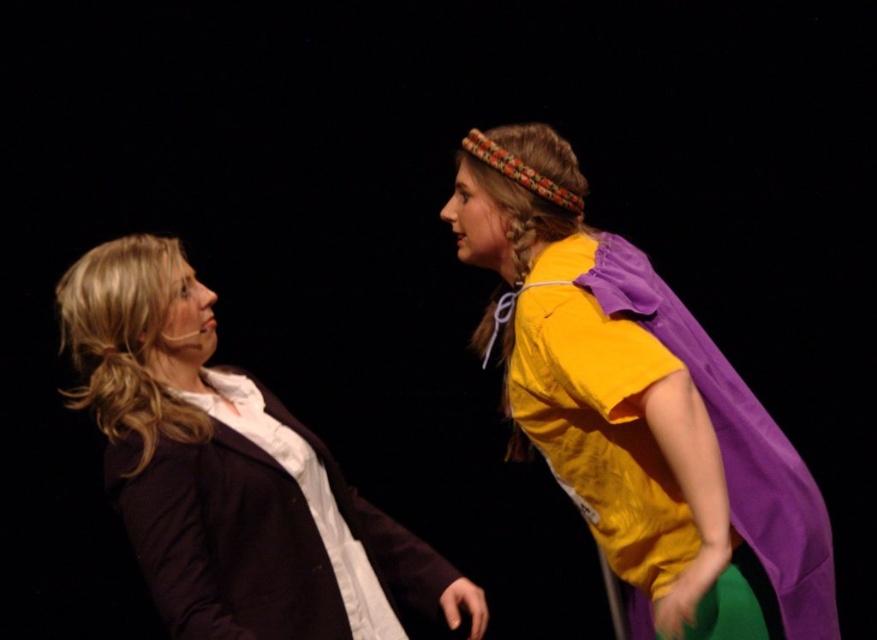
You are a photographer standing at the back of the stage. You want to take a photo of both the yellow matte shirt at upper right and the matte black blazer at left. Which one will appear larger in the photo?

The yellow matte shirt at upper right will appear larger in the photo because it is closer to the viewer than the matte black blazer at left.

You are standing in front of the stage, and you want to toss a small object to the person wearing the yellow matte shirt at upper right. The object can travel a maximum distance of 1.5 meters. Will it reach them?

The distance between the yellow matte shirt at upper right and the viewer is 1.47 meters, so the object can reach them since it is within the maximum travel distance of 1.5 meters.